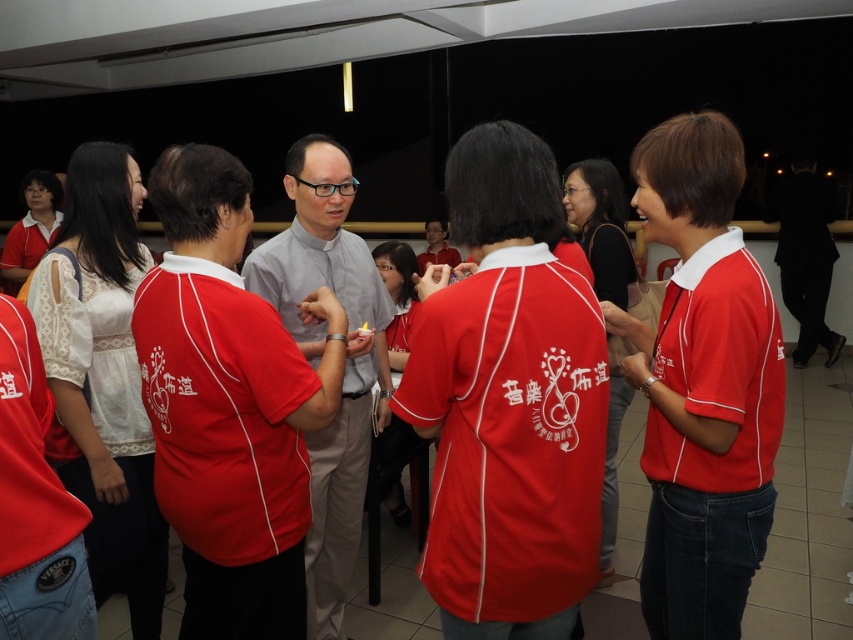
Which is more to the right, light gray fabric shirt at center or light gray shirt at center?

light gray shirt at center

Is point (213, 280) positioned in front of point (331, 140)?

Yes, it is in front of point (331, 140).

Locate an element on the screen. Image resolution: width=853 pixels, height=640 pixels. light gray fabric shirt at center is located at coordinates (229, 404).